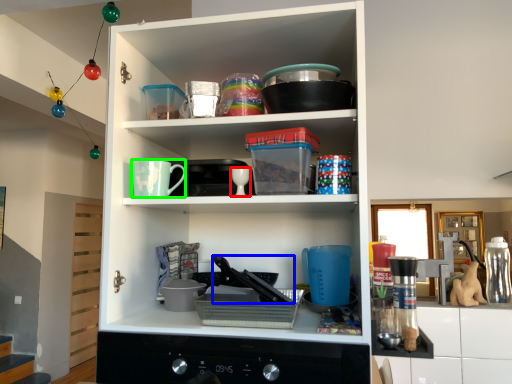
Question: Which object is the closest to the tableware (highlighted by a red box)? Choose among these: appliance (highlighted by a blue box) or mug (highlighted by a green box).

Choices:
 (A) appliance
 (B) mug

Answer: (B)